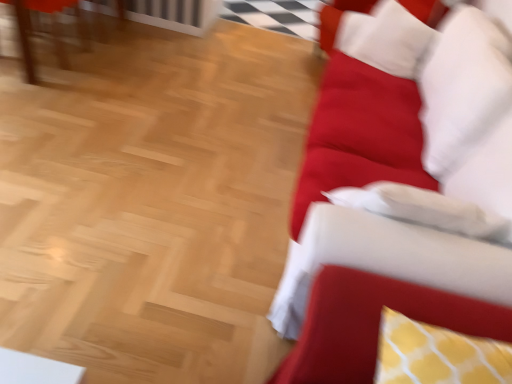
Where is `yellow dotted cushion at right`? Image resolution: width=512 pixels, height=384 pixels. yellow dotted cushion at right is located at coordinates (373, 324).

Find the location of a particular element. The height and width of the screenshot is (384, 512). velvet red couch at right is located at coordinates (400, 191).

What do you see at coordinates (389, 36) in the screenshot? This screenshot has height=384, width=512. I see `white soft pillow at upper right` at bounding box center [389, 36].

Locate an element on the screen. The height and width of the screenshot is (384, 512). yellow dotted cushion at right is located at coordinates (373, 324).

Is point (477, 264) positioned behind point (24, 20)?

No, (477, 264) is in front of (24, 20).

Is velvet red couch at right positioned with its back to matte wooden table at upper left?

No, matte wooden table at upper left is not at the back of velvet red couch at right.

From a real-world perspective, relative to matte wooden table at upper left, is velvet red couch at right vertically above or below?

Clearly, from a real-world perspective, velvet red couch at right is above matte wooden table at upper left.

Is velvet red couch at right placed right next to matte wooden table at upper left?

No, velvet red couch at right is not making contact with matte wooden table at upper left.

Is matte wooden table at upper left thinner than velvet red couch at right?

Yes, matte wooden table at upper left is thinner than velvet red couch at right.

Is matte wooden table at upper left inside the boundaries of velvet red couch at right, or outside?

matte wooden table at upper left lies outside velvet red couch at right.

Between matte wooden table at upper left and velvet red couch at right, which one has larger size?

velvet red couch at right is bigger.

Locate an element on the screen. This screenshot has height=384, width=512. furniture that is on the left side of velvet red couch at right is located at coordinates (51, 30).

In the image, is matte wooden table at upper left on the left side or the right side of yellow dotted cushion at right?

Based on their positions, matte wooden table at upper left is located to the left of yellow dotted cushion at right.

Which point is more distant from viewer, (76, 4) or (361, 328)?

Point (76, 4)

Considering the sizes of objects matte wooden table at upper left and yellow dotted cushion at right in the image provided, who is wider, matte wooden table at upper left or yellow dotted cushion at right?

matte wooden table at upper left.

Is yellow dotted cushion at right completely or partially inside matte wooden table at upper left?

That's incorrect, yellow dotted cushion at right is not inside matte wooden table at upper left.

Consider the image. Is velvet red couch at right closer to the viewer compared to yellow dotted cushion at right?

No, velvet red couch at right is behind yellow dotted cushion at right.

Which object is positioned more to the left, velvet red couch at right or yellow dotted cushion at right?

Positioned to the left is yellow dotted cushion at right.

From a real-world perspective, is velvet red couch at right located beneath yellow dotted cushion at right?

Yes, from a real-world perspective, velvet red couch at right is beneath yellow dotted cushion at right.

Which is farther from the camera, (x=481, y=266) or (x=494, y=318)?

The point (x=481, y=266) is farther from the camera.

Considering the relative sizes of white soft pillow at upper right and velvet red couch at right in the image provided, is white soft pillow at upper right smaller than velvet red couch at right?

Indeed, white soft pillow at upper right has a smaller size compared to velvet red couch at right.

From the image's perspective, which is above, white soft pillow at upper right or velvet red couch at right?

white soft pillow at upper right, from the image's perspective.

Is white soft pillow at upper right situated inside velvet red couch at right or outside?

The correct answer is: inside.

What's the angular difference between matte wooden table at upper left and white soft pillow at upper right's facing directions?

The angular difference between matte wooden table at upper left and white soft pillow at upper right is 82.2 degrees.

Does matte wooden table at upper left have a larger size compared to white soft pillow at upper right?

Yes.

Is matte wooden table at upper left in front of or behind white soft pillow at upper right in the image?

In the image, matte wooden table at upper left appears behind white soft pillow at upper right.

Which is more to the right, matte wooden table at upper left or white soft pillow at upper right?

white soft pillow at upper right is more to the right.

Can you tell me how much white soft pillow at upper right and matte wooden table at upper left differ in facing direction?

82.2 degrees.

Image resolution: width=512 pixels, height=384 pixels. I want to click on pillow lying below the matte wooden table at upper left (from the image's perspective), so click(x=389, y=36).

From a real-world perspective, which is physically above, white soft pillow at upper right or matte wooden table at upper left?

white soft pillow at upper right, from a real-world perspective.

Does point (362, 36) come in front of point (59, 51)?

That is True.

Where is `studio couch lying below the matte wooden table at upper left (from the image's perspective)`? Image resolution: width=512 pixels, height=384 pixels. studio couch lying below the matte wooden table at upper left (from the image's perspective) is located at coordinates (400, 191).

Find the location of `furniture to the left of velvet red couch at right`. furniture to the left of velvet red couch at right is located at coordinates click(x=51, y=30).

Looking at the image, which one is located further to white soft pillow at upper right, yellow dotted cushion at right or velvet red couch at right?

yellow dotted cushion at right is further to white soft pillow at upper right.

Considering their positions, is velvet red couch at right positioned further to yellow dotted cushion at right than matte wooden table at upper left?

matte wooden table at upper left lies further to yellow dotted cushion at right than the other object.

Which object lies nearer to the anchor point matte wooden table at upper left, velvet red couch at right or white soft pillow at upper right?

white soft pillow at upper right is positioned closer to the anchor matte wooden table at upper left.

Based on the photo, considering their positions, is white soft pillow at upper right positioned further to matte wooden table at upper left than velvet red couch at right?

velvet red couch at right is positioned further to the anchor matte wooden table at upper left.

Consider the image. Considering their positions, is yellow dotted cushion at right positioned closer to matte wooden table at upper left than white soft pillow at upper right?

white soft pillow at upper right.

Looking at the image, which one is located further to matte wooden table at upper left, velvet red couch at right or yellow dotted cushion at right?

yellow dotted cushion at right is further to matte wooden table at upper left.

Estimate the real-world distances between objects in this image. Which object is closer to velvet red couch at right, yellow dotted cushion at right or white soft pillow at upper right?

yellow dotted cushion at right is closer to velvet red couch at right.

Which object lies further to the anchor point white soft pillow at upper right, matte wooden table at upper left or yellow dotted cushion at right?

Based on the image, matte wooden table at upper left appears to be further to white soft pillow at upper right.

This screenshot has width=512, height=384. Find the location of `swivel chair between matte wooden table at upper left and white soft pillow at upper right`. swivel chair between matte wooden table at upper left and white soft pillow at upper right is located at coordinates (373, 324).

You are a GUI agent. You are given a task and a screenshot of the screen. Output one action in this format:
    pyautogui.click(x=<x>, y=<y>)
    Task: Click on the studio couch located between matte wooden table at upper left and white soft pillow at upper right in the left-right direction
    The image size is (512, 384).
    Given the screenshot: What is the action you would take?
    click(x=400, y=191)

Find the location of `swivel chair between matte wooden table at upper left and velvet red couch at right`. swivel chair between matte wooden table at upper left and velvet red couch at right is located at coordinates (373, 324).

At what (x,y) coordinates should I click in order to perform the action: click on studio couch between yellow dotted cushion at right and white soft pillow at upper right in the front-back direction. Please return your answer as a coordinate pair (x, y). Image resolution: width=512 pixels, height=384 pixels. Looking at the image, I should click on click(x=400, y=191).